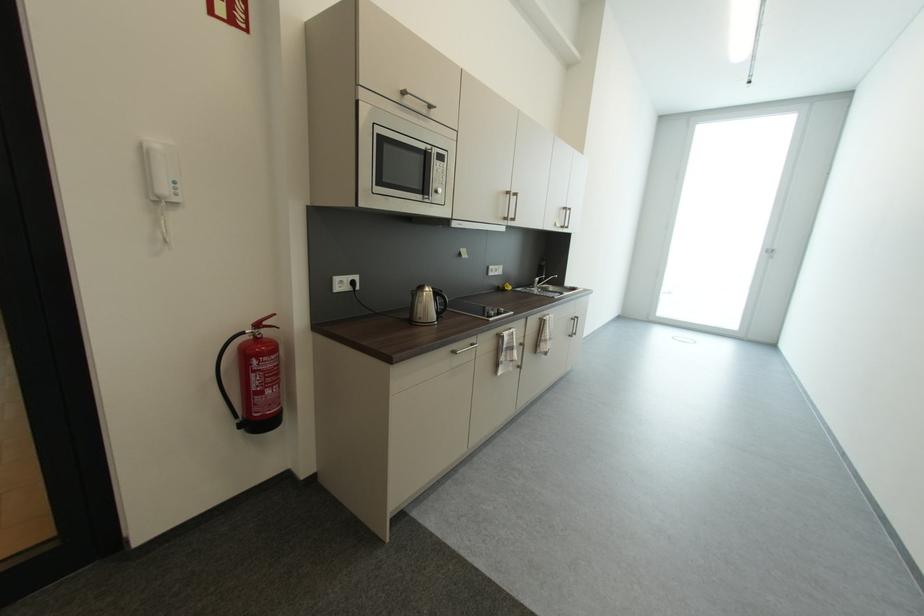
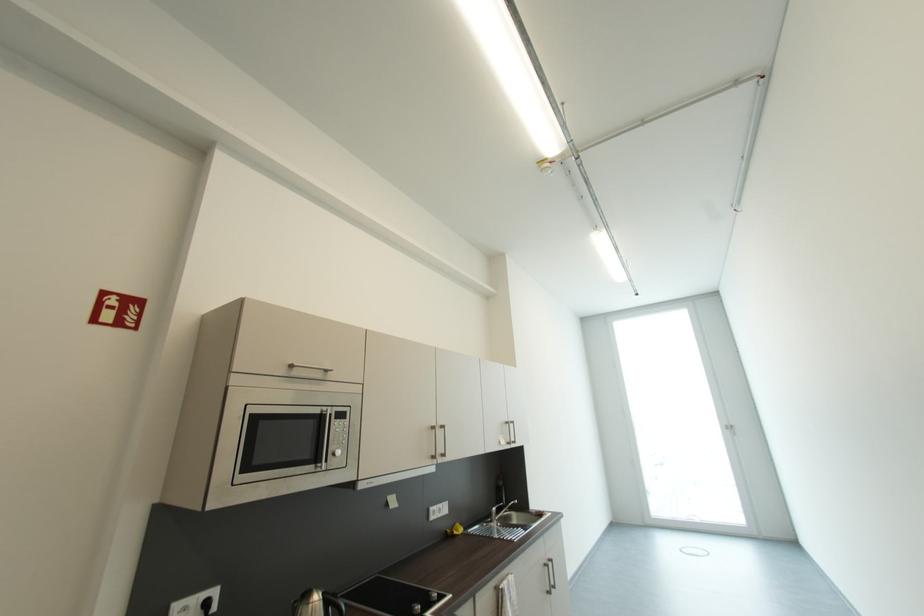
The point at [578,321] is marked in the first image. Where is the corresponding point in the second image?

(552, 567)